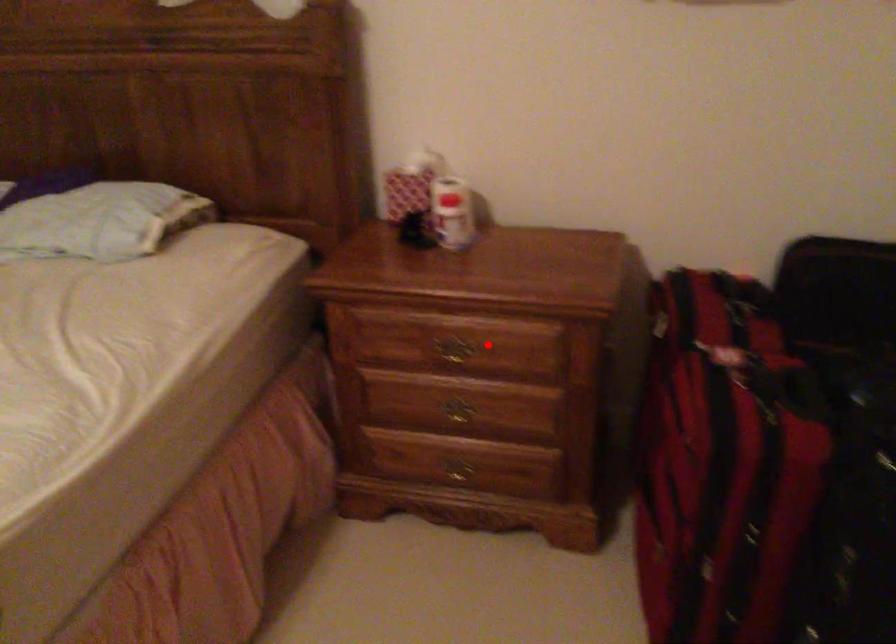
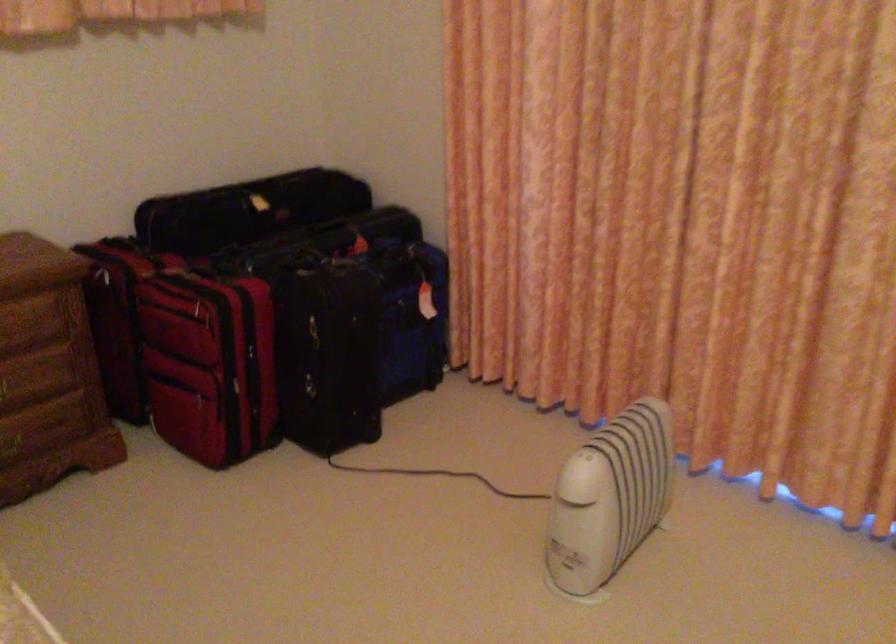
Question: I am providing you with two images of the same scene from different viewpoints. A red point is marked on the first image. Can you still see the location of the red point in image 2?

Choices:
 (A) Yes
 (B) No

Answer: (A)